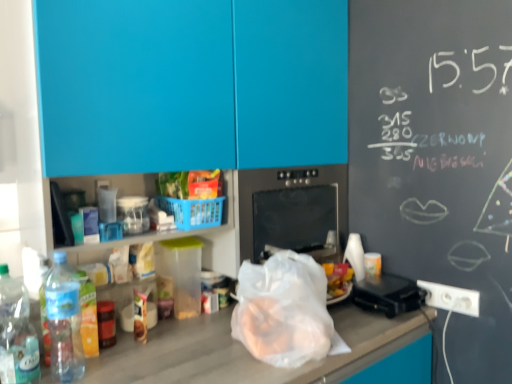
The height and width of the screenshot is (384, 512). What are the coordinates of `white plastic electric outlet at lower right` in the screenshot? It's located at (451, 298).

Image resolution: width=512 pixels, height=384 pixels. Describe the element at coordinates (191, 84) in the screenshot. I see `blue matte cabinet at upper center` at that location.

Identify the location of blue matte cabinet at upper center. The image size is (512, 384). (191, 84).

Locate an element on the screen. The height and width of the screenshot is (384, 512). white plastic electric outlet at lower right is located at coordinates (x=451, y=298).

Can you confirm if shiny plastic bag of chips at center is smaller than transparent plastic bag at center?

Yes, shiny plastic bag of chips at center is smaller than transparent plastic bag at center.

In terms of width, does shiny plastic bag of chips at center look wider or thinner when compared to transparent plastic bag at center?

shiny plastic bag of chips at center is thinner than transparent plastic bag at center.

From a real-world perspective, which object rests below the other?

transparent plastic bag at center, from a real-world perspective.

Does point (166, 191) lie behind point (240, 330)?

Yes.

Based on the photo, considering the sizes of objects blue matte cabinet at upper center and black glass oven at center in the image provided, who is wider, blue matte cabinet at upper center or black glass oven at center?

black glass oven at center.

From a real-world perspective, which is physically below, blue matte cabinet at upper center or black glass oven at center?

From a 3D spatial view, black glass oven at center is below.

Does blue matte cabinet at upper center have a greater height compared to black glass oven at center?

Correct, blue matte cabinet at upper center is much taller as black glass oven at center.

Which is correct: blue matte cabinet at upper center is inside black glass oven at center, or outside of it?

blue matte cabinet at upper center is spatially situated outside black glass oven at center.

From the image's perspective, which one is positioned higher, black plastic toaster at right or blue plastic basket at center?

From the image's view, blue plastic basket at center is above.

Relative to blue plastic basket at center, is black plastic toaster at right in front or behind?

black plastic toaster at right is behind blue plastic basket at center.

From the picture: How many degrees apart are the facing directions of black plastic toaster at right and blue plastic basket at center?

The angle between the facing direction of black plastic toaster at right and the facing direction of blue plastic basket at center is 3.1 degrees.

Is black plastic toaster at right positioned beyond the bounds of blue plastic basket at center?

Yes, black plastic toaster at right is not within blue plastic basket at center.

Considering the sizes of black glass oven at center and blue plastic basket at center in the image, is black glass oven at center bigger or smaller than blue plastic basket at center?

Considering their sizes, black glass oven at center takes up more space than blue plastic basket at center.

Considering the relative positions of black glass oven at center and blue plastic basket at center in the image provided, is black glass oven at center to the left of blue plastic basket at center from the viewer's perspective?

Incorrect, black glass oven at center is not on the left side of blue plastic basket at center.

How different are the orientations of black glass oven at center and blue plastic basket at center in degrees?

The angular difference between black glass oven at center and blue plastic basket at center is 3.1 degrees.

Which object is thinner, black glass oven at center or blue plastic basket at center?

blue plastic basket at center is thinner.

How different are the orientations of translucent plastic bottle at left, which is the second bottle from right to left, and blue plastic basket at center in degrees?

The angle between the facing direction of translucent plastic bottle at left, which is the second bottle from right to left, and the facing direction of blue plastic basket at center is 3.1 degrees.

From a real-world perspective, is translucent plastic bottle at left, positioned as the 1th bottle in left-to-right order, below blue plastic basket at center?

Yes, from a real-world perspective, translucent plastic bottle at left, positioned as the 1th bottle in left-to-right order, is beneath blue plastic basket at center.

Is translucent plastic bottle at left, which is the second bottle from right to left, in front of or behind blue plastic basket at center in the image?

In the image, translucent plastic bottle at left, which is the second bottle from right to left, appears in front of blue plastic basket at center.

Is translucent plastic bottle at left, which is the second bottle from right to left, positioned far away from blue plastic basket at center?

No, translucent plastic bottle at left, which is the second bottle from right to left, is in close proximity to blue plastic basket at center.

Is blue plastic basket at center in front of or behind transparent plastic bag at center in the image?

blue plastic basket at center is positioned farther from the viewer than transparent plastic bag at center.

From the picture: From the image's perspective, is blue plastic basket at center on transparent plastic bag at center?

Yes, from the image's perspective, blue plastic basket at center is above transparent plastic bag at center.

Is blue plastic basket at center spatially inside transparent plastic bag at center, or outside of it?

blue plastic basket at center is not inside transparent plastic bag at center, it's outside.

Which is behind, point (178, 205) or point (260, 285)?

Positioned behind is point (178, 205).

Consider the image. How distant is shiny plastic bag of chips at center from blue plastic basket at center?

shiny plastic bag of chips at center is 2.06 inches away from blue plastic basket at center.

Is shiny plastic bag of chips at center aimed at blue plastic basket at center?

No, shiny plastic bag of chips at center is not aimed at blue plastic basket at center.

Visually, is shiny plastic bag of chips at center positioned to the left or to the right of blue plastic basket at center?

From the image, it's evident that shiny plastic bag of chips at center is to the left of blue plastic basket at center.

From a real-world perspective, is shiny plastic bag of chips at center on blue plastic basket at center?

Indeed, from a real-world perspective, shiny plastic bag of chips at center stands above blue plastic basket at center.

At what (x,y) coordinates should I click in order to perform the action: click on plastic bag that is in front of the shiny plastic bag of chips at center. Please return your answer as a coordinate pair (x, y). The width and height of the screenshot is (512, 384). Looking at the image, I should click on (285, 311).

The image size is (512, 384). I want to click on oven behind the blue matte cabinet at upper center, so click(293, 210).

Considering their positions, is blue plastic basket at center positioned closer to transparent plastic bag at center than black plastic toaster at right?

Among the two, blue plastic basket at center is located nearer to transparent plastic bag at center.

Which object lies nearer to the anchor point white plastic electric outlet at lower right, shiny plastic bag of chips at center or translucent plastic bottle at left, which is the second bottle from right to left?

Based on the image, shiny plastic bag of chips at center appears to be nearer to white plastic electric outlet at lower right.

Looking at the image, which one is located further to transparent plastic bag at center, blue plastic basket at center or blue matte cabinet at upper center?

Based on the image, blue matte cabinet at upper center appears to be further to transparent plastic bag at center.

When comparing their distances from black glass oven at center, does shiny plastic bag of chips at center or clear plastic bottle at lower left, the first bottle when ordered from right to left, seem further?

The object further to black glass oven at center is clear plastic bottle at lower left, the first bottle when ordered from right to left.

When comparing their distances from black glass oven at center, does translucent plastic bottle at left, positioned as the 1th bottle in left-to-right order, or white plastic electric outlet at lower right seem closer?

white plastic electric outlet at lower right is positioned closer to the anchor black glass oven at center.

From the image, which object appears to be nearer to blue matte cabinet at upper center, clear plastic bottle at lower left, the first bottle when ordered from right to left, or black glass oven at center?

black glass oven at center.

Looking at the image, which one is located further to white plastic electric outlet at lower right, transparent plastic bag at center or shiny plastic bag of chips at center?

The object further to white plastic electric outlet at lower right is shiny plastic bag of chips at center.

From the image, which object appears to be nearer to translucent plastic bottle at left, positioned as the 1th bottle in left-to-right order, clear plastic bottle at lower left, the 2th bottle from the left, or white plastic electric outlet at lower right?

The object closer to translucent plastic bottle at left, positioned as the 1th bottle in left-to-right order, is clear plastic bottle at lower left, the 2th bottle from the left.

At what (x,y) coordinates should I click in order to perform the action: click on plastic bag situated between blue matte cabinet at upper center and white plastic electric outlet at lower right from left to right. Please return your answer as a coordinate pair (x, y). The width and height of the screenshot is (512, 384). Looking at the image, I should click on (285, 311).

Identify the location of bottle between translucent plastic bottle at left, positioned as the 1th bottle in left-to-right order, and white plastic electric outlet at lower right. The width and height of the screenshot is (512, 384). (64, 321).

Identify the location of plastic bag between translucent plastic bottle at left, which is the second bottle from right to left, and white plastic electric outlet at lower right, in the horizontal direction. (285, 311).

This screenshot has height=384, width=512. Identify the location of oven between clear plastic bottle at lower left, the 2th bottle from the left, and black plastic toaster at right. (293, 210).